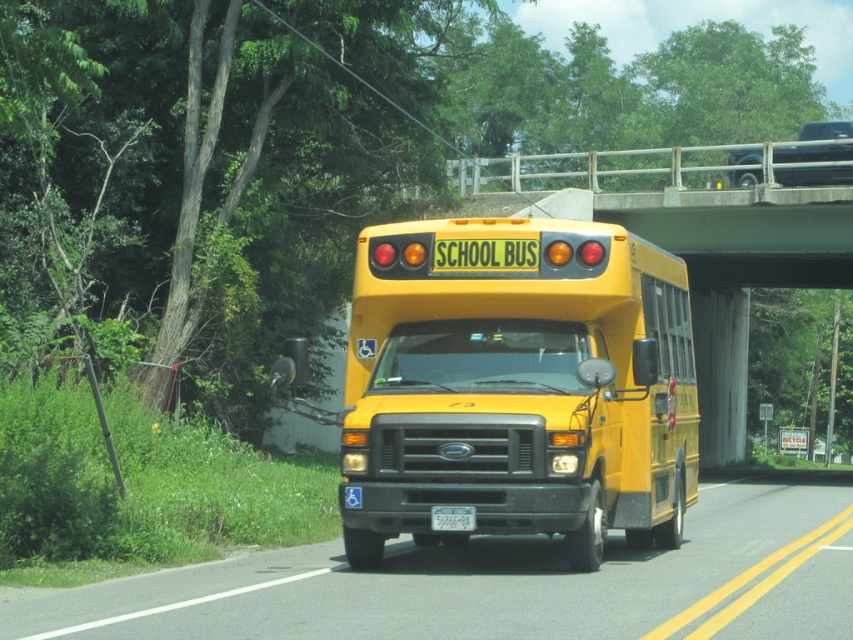
Question: Which point appears farthest from the camera in this image?

Choices:
 (A) (682, 328)
 (B) (473, 522)

Answer: (A)

Question: From the image, what is the correct spatial relationship of yellow matte/solid school bus at center in relation to yellow matte school bus at center?

Choices:
 (A) right
 (B) left

Answer: (B)

Question: Is yellow matte/solid school bus at center closer to camera compared to white plastic license plate at center?

Choices:
 (A) no
 (B) yes

Answer: (B)

Question: Which point is farther to the camera?

Choices:
 (A) (402, 236)
 (B) (467, 506)

Answer: (A)

Question: Among these points, which one is farthest from the camera?

Choices:
 (A) (84, 625)
 (B) (465, 508)
 (C) (610, 269)

Answer: (C)

Question: Can you confirm if yellow matte/solid school bus at center is thinner than white plastic license plate at center?

Choices:
 (A) yes
 (B) no

Answer: (B)